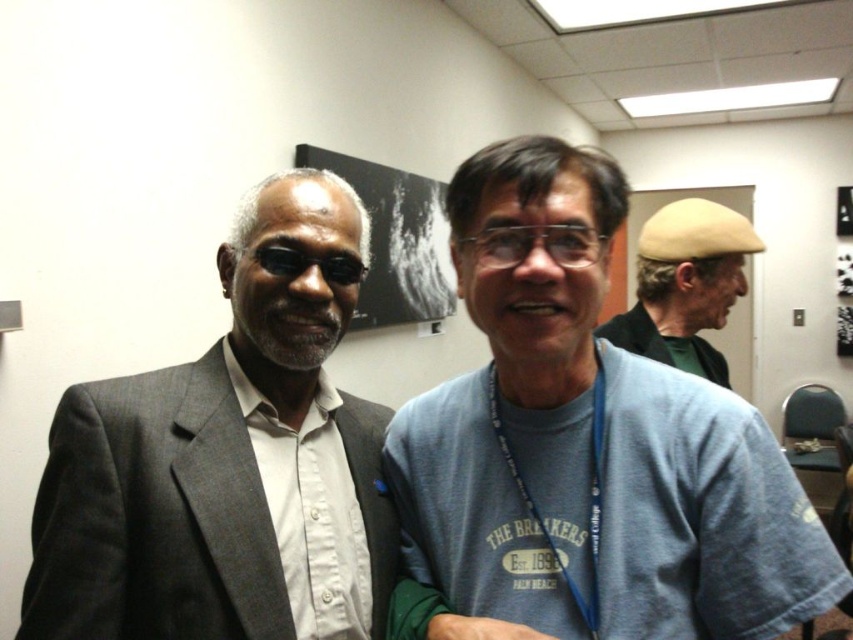
You are a photographer adjusting your camera settings to focus on the matte gray suit at left and the beige felt hat at upper right. Which object should you focus on first to ensure proper depth of field?

The matte gray suit at left is closer to the viewer than the beige felt hat at upper right, so you should focus on the matte gray suit at left first to ensure proper depth of field.